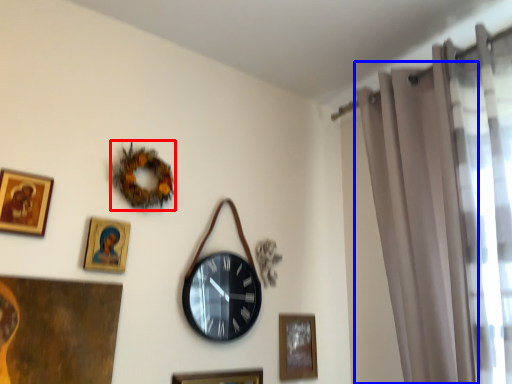
Question: Which object is further to the camera taking this photo, decor (highlighted by a red box) or curtain (highlighted by a blue box)?

Choices:
 (A) decor
 (B) curtain

Answer: (A)